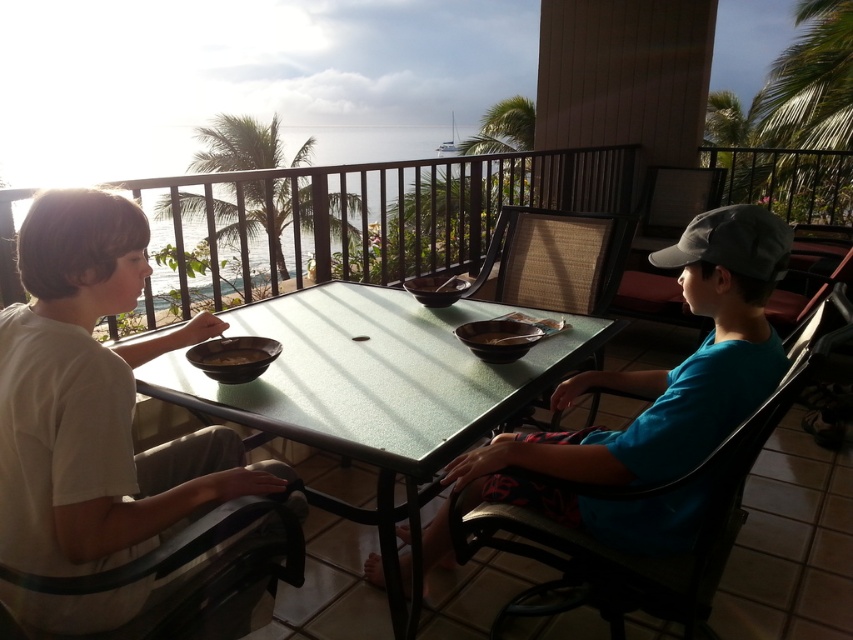
In the scene shown: Who is lower down, green matte table at center or woven wicker chair at center?

Positioned lower is green matte table at center.

The image size is (853, 640). Describe the element at coordinates (374, 388) in the screenshot. I see `green matte table at center` at that location.

What do you see at coordinates (374, 388) in the screenshot? This screenshot has height=640, width=853. I see `green matte table at center` at bounding box center [374, 388].

Find the location of a particular element. Image resolution: width=853 pixels, height=640 pixels. green matte table at center is located at coordinates (374, 388).

Is green matte table at center behind brown matte bowl at center?

No.

From the picture: Can you confirm if green matte table at center is bigger than brown matte bowl at center?

Yes.

Does point (471, 413) come in front of point (466, 284)?

Yes, it is.

I want to click on green matte table at center, so click(374, 388).

Is matte black chair at right smaller than brown matte bowl at left?

Incorrect, matte black chair at right is not smaller in size than brown matte bowl at left.

Locate an element on the screen. The height and width of the screenshot is (640, 853). matte black chair at right is located at coordinates (665, 243).

I want to click on matte black chair at right, so click(665, 243).